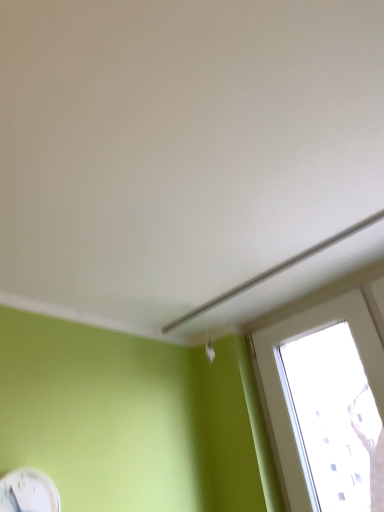
The width and height of the screenshot is (384, 512). What do you see at coordinates (28, 492) in the screenshot?
I see `white plastic clock at lower left` at bounding box center [28, 492].

In order to face white plastic clock at lower left, should I rotate leftwards or rightwards?

To align with it, rotate left about 22.298°.

Where is `white plastic clock at lower left`? white plastic clock at lower left is located at coordinates (28, 492).

Locate an element on the screen. white plastic clock at lower left is located at coordinates (28, 492).